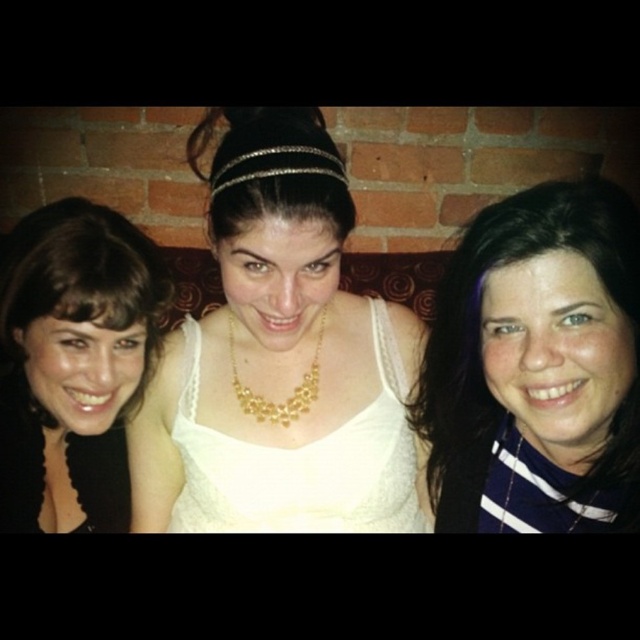
You are a photographer adjusting your camera settings. You notice the white lace dress at center and the gold metallic necklace at center. Which object should you focus on first if you want to capture both in sharp focus?

The white lace dress at center is closer to the viewer than the gold metallic necklace at center, so you should focus on the white lace dress at center first to ensure both are in sharp focus.

You are a photographer adjusting your camera settings. You want to focus on the central figure wearing a white sleeveless top and gold necklace with a floral design. The camera can only focus on objects within 35 inches. Is the point at coordinates point (292, 372) within the focus range?

The point at coordinates point (292, 372) is 38.92 inches away from the camera, which is beyond the 35 inches focus range. Therefore, the camera cannot focus on that point.

Looking at this image, you are a photographer trying to capture a closeup of the gold metallic necklace at center without including the white lace dress at center in the frame. Is this possible given their sizes?

The white lace dress at center has a larger size compared to gold metallic necklace at center, so it might be challenging to capture the gold metallic necklace at center without including the white lace dress at center in the frame due to its larger size.